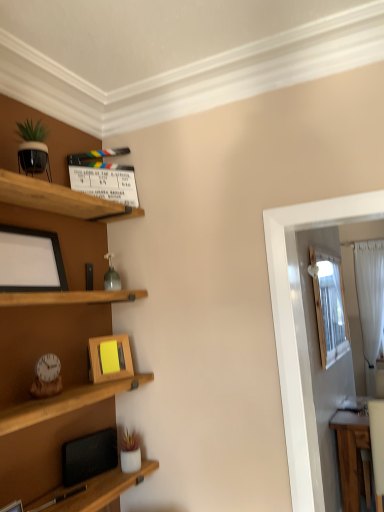
Question: In the image, is matte black picture frame at left, which is the first picture frame in left-to-right order, on the left side or the right side of white sheer curtain at right?

Choices:
 (A) right
 (B) left

Answer: (B)

Question: Is point (43, 266) closer or farther from the camera than point (372, 309)?

Choices:
 (A) farther
 (B) closer

Answer: (B)

Question: Based on their relative distances, which object is nearer to the matte black picture frame at left, marked as the 2th picture frame in a bottom-to-top arrangement?

Choices:
 (A) white sheer curtain at right
 (B) wooden picture frame at center, which is counted as the 1th picture frame, starting from the bottom

Answer: (B)

Question: Estimate the real-world distances between objects in this image. Which object is farther from the wooden picture frame at center, which ranks as the 2th picture frame in top-to-bottom order?

Choices:
 (A) matte black picture frame at left, the 2th picture frame positioned from the back
 (B) white sheer curtain at right

Answer: (B)